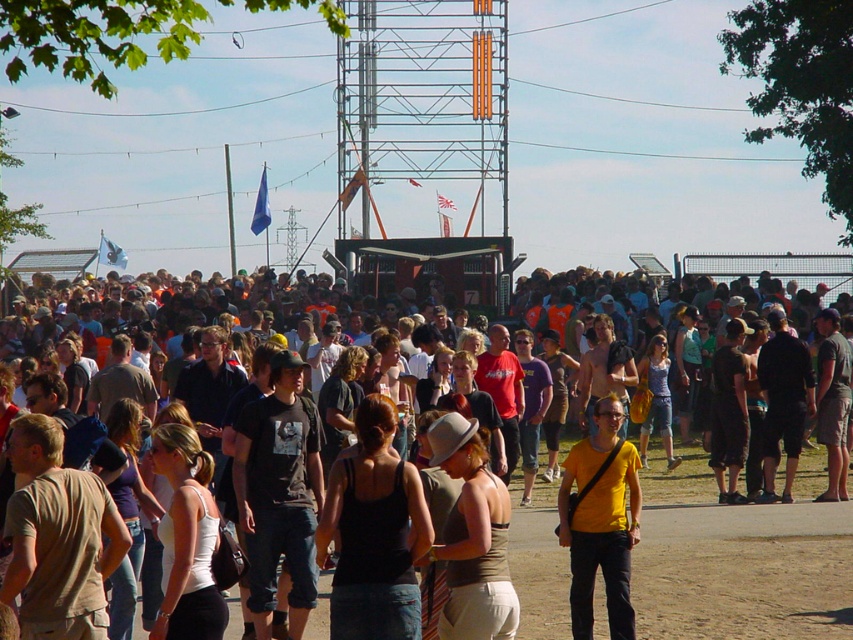
From the picture: Between black tank top at center and yellow matte t-shirt at center, which one has less height?

With less height is black tank top at center.

Can you confirm if black tank top at center is positioned above yellow matte t-shirt at center?

No.

Who is more distant from viewer, [364,506] or [573,616]?

The point [573,616] is more distant.

This screenshot has height=640, width=853. I want to click on black tank top at center, so click(374, 532).

Does matte black tank top at center have a greater width compared to black tank top at center?

Correct, the width of matte black tank top at center exceeds that of black tank top at center.

Who is shorter, matte black tank top at center or black tank top at center?

Standing shorter between the two is black tank top at center.

Between point (322, 616) and point (381, 451), which one is positioned in front?

Point (381, 451) is more forward.

Locate an element on the screen. The image size is (853, 640). matte black tank top at center is located at coordinates (735, 564).

Who is higher up, matte black tank top at center or yellow matte t-shirt at center?

matte black tank top at center is higher up.

Measure the distance between matte black tank top at center and yellow matte t-shirt at center.

matte black tank top at center and yellow matte t-shirt at center are 30.44 feet apart from each other.

Does point (335, 381) come behind point (583, 476)?

Yes.

Image resolution: width=853 pixels, height=640 pixels. What are the coordinates of `matte black tank top at center` in the screenshot? It's located at (735, 564).